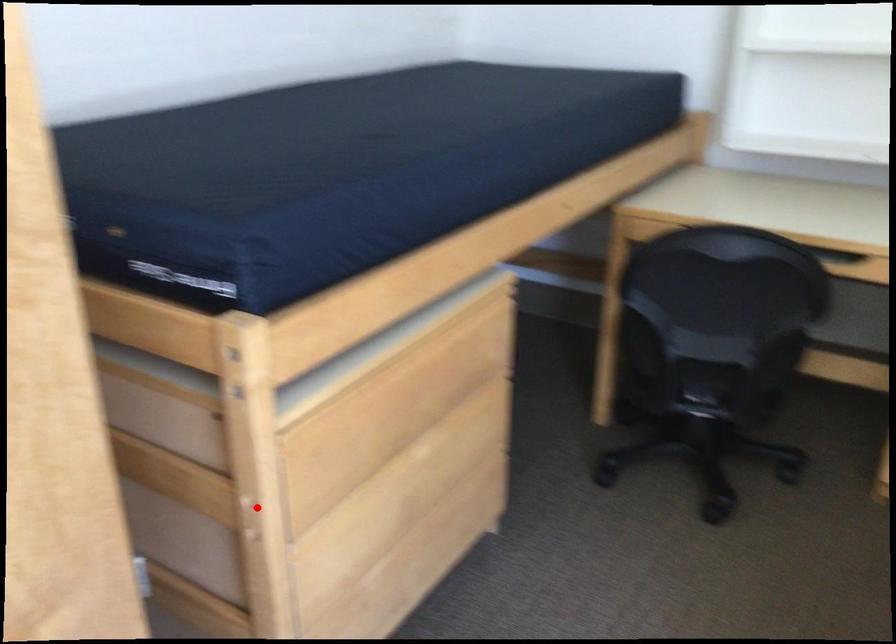
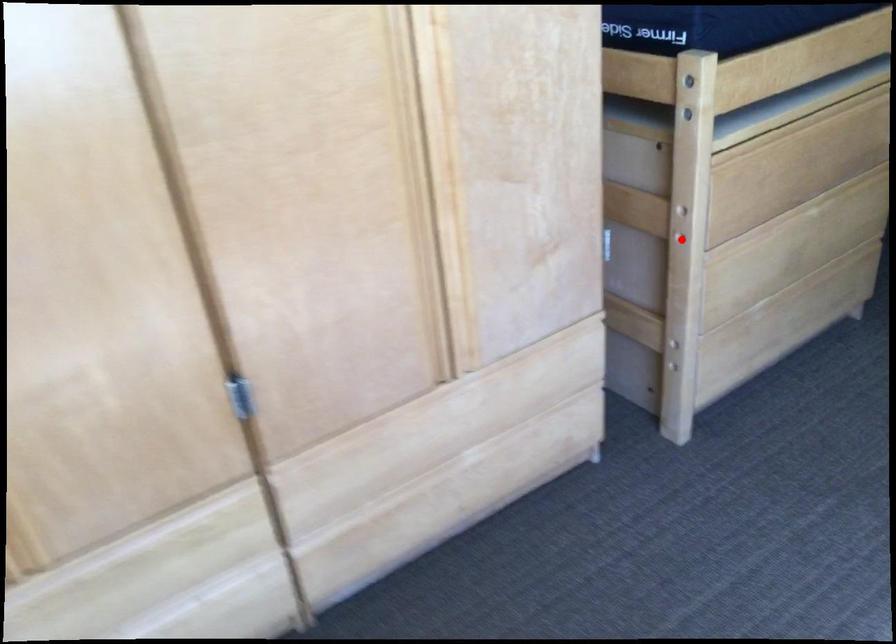
I am providing you with two images of the same scene from different viewpoints. A red point is marked on the first image and another point is marked on the second image. Does the point marked in image1 correspond to the same location as the one in image2?

No